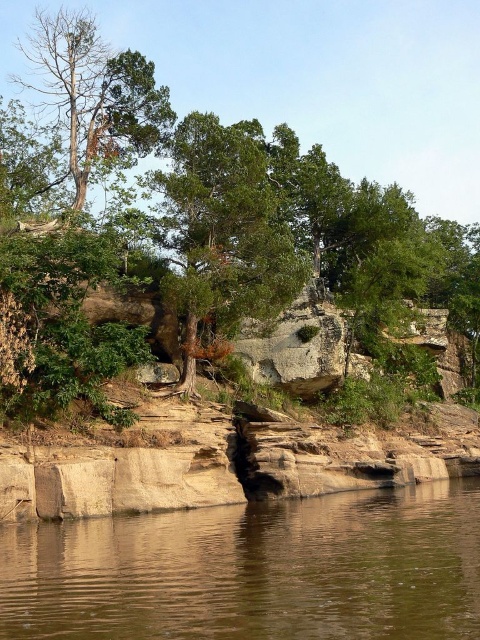
Question: Is brown smooth water at lower center wider than green leafy tree at center?

Choices:
 (A) no
 (B) yes

Answer: (A)

Question: Which object is the closest to the dead brown tree at upper left?

Choices:
 (A) green matte tree at center
 (B) green leafy tree at center
 (C) brown smooth water at lower center

Answer: (A)

Question: Can you confirm if green matte tree at center is wider than dead brown tree at upper left?

Choices:
 (A) no
 (B) yes

Answer: (A)

Question: Which of these objects is positioned farthest from the dead brown tree at upper left?

Choices:
 (A) brown smooth water at lower center
 (B) green matte tree at center

Answer: (A)

Question: Is green matte tree at center bigger than dead brown tree at upper left?

Choices:
 (A) no
 (B) yes

Answer: (A)

Question: Which object is the farthest from the green matte tree at center?

Choices:
 (A) green leafy tree at center
 (B) brown smooth water at lower center

Answer: (A)